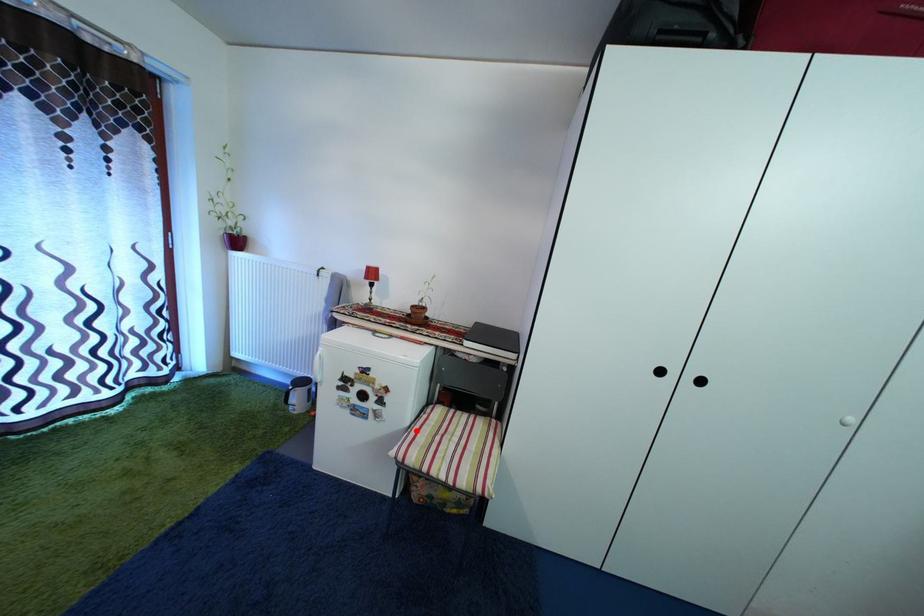
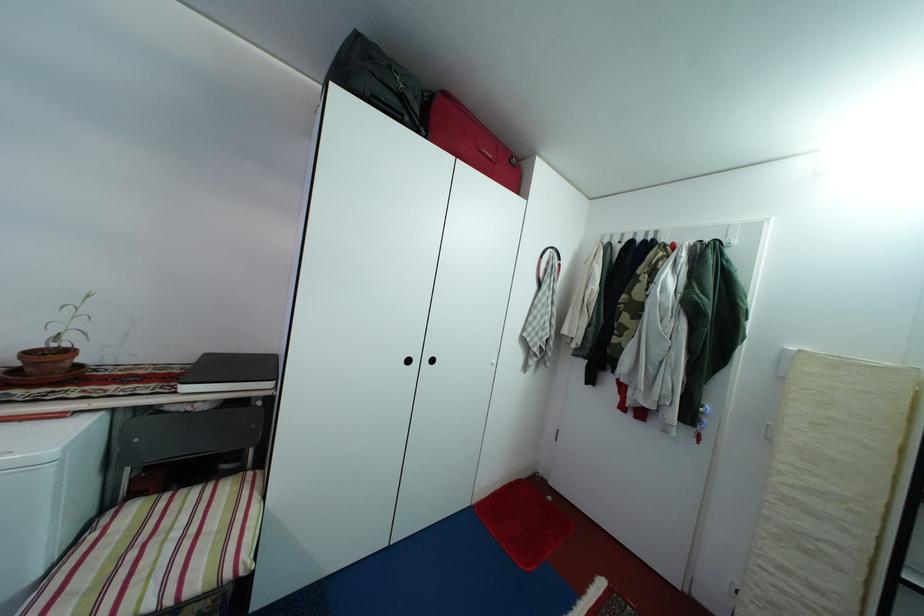
The point at the highlighted location is marked in the first image. Where is the corresponding point in the second image?

(47, 581)